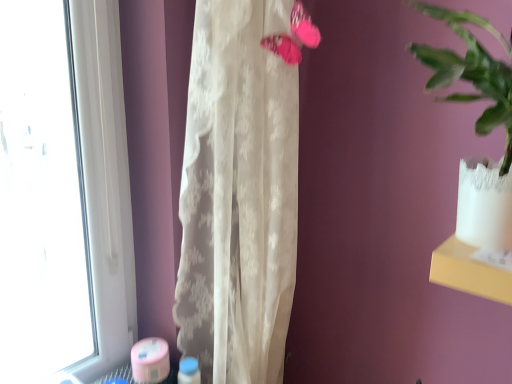
Question: From the image's perspective, relative to translucent white curtain at center, is pink fabric butterfly at upper center above or below?

Choices:
 (A) below
 (B) above

Answer: (B)

Question: From their relative heights in the image, would you say pink fabric butterfly at upper center is taller or shorter than translucent white curtain at center?

Choices:
 (A) tall
 (B) short

Answer: (B)

Question: Based on their sizes in the image, would you say pink fabric butterfly at upper center is bigger or smaller than translucent white curtain at center?

Choices:
 (A) small
 (B) big

Answer: (A)

Question: In the image, is translucent white curtain at center positioned in front of or behind pink fabric butterfly at upper center?

Choices:
 (A) behind
 (B) front

Answer: (B)

Question: From a real-world perspective, is translucent white curtain at center positioned above or below pink fabric butterfly at upper center?

Choices:
 (A) below
 (B) above

Answer: (A)

Question: Looking at the image, does translucent white curtain at center seem bigger or smaller compared to pink fabric butterfly at upper center?

Choices:
 (A) small
 (B) big

Answer: (B)

Question: Looking at their shapes, would you say translucent white curtain at center is wider or thinner than pink fabric butterfly at upper center?

Choices:
 (A) wide
 (B) thin

Answer: (A)